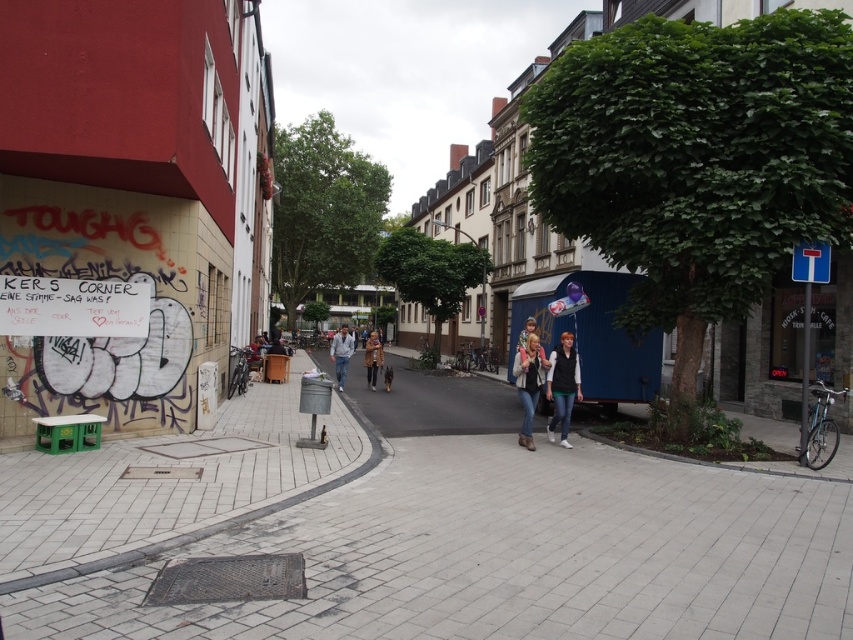
You are standing at the intersection in the urban street scene. There is a point marked at coordinates (x=419, y=536) which is on the smooth concrete pavement at center. If you want to walk from the red facade building on the left to this point, which direction should you head?

You should head towards the center of the image because the point marked at (x=419, y=536) is located on the smooth concrete pavement at center, which is directly in front of the red facade building on the left.

Looking at this image, you are a street artist planning to paint a mural between the denim jeans at center and the brown leather jacket at center. Which object should you place your ladder closer to if you want to paint a smaller section?

You should place your ladder closer to the denim jeans at center because it has a smaller size compared to the brown leather jacket at center, requiring a smaller painting area.

You are standing on the smooth concrete pavement at center and want to walk to the denim jeans at center. Which direction should you move?

You should move to the right, since the denim jeans at center are to the right of the smooth concrete pavement at center.